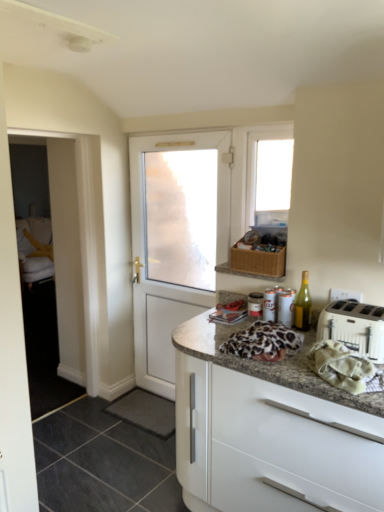
Identify the location of vacant space in front of white glossy screen door at left. (79, 430).